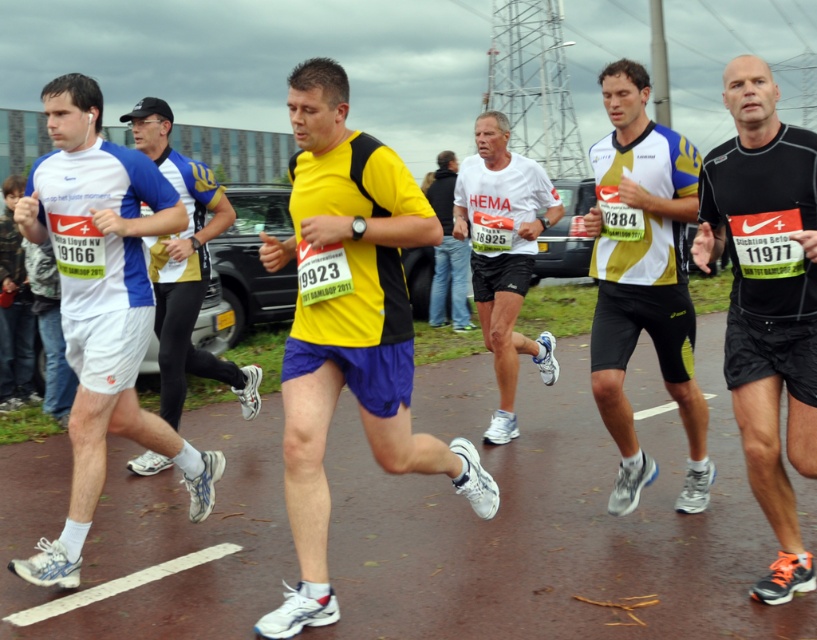
Can you confirm if black matte running shoe at center is smaller than white matte shirt at center?

Yes.

In order to click on black matte running shoe at center in this screenshot , I will do `click(766, 300)`.

Between black matte running shoe at center and yellow and white jersey at center, which one appears on the left side from the viewer's perspective?

Positioned to the left is yellow and white jersey at center.

Is black matte running shoe at center thinner than yellow and white jersey at center?

Yes, black matte running shoe at center is thinner than yellow and white jersey at center.

Who is more forward, [795,292] or [650,148]?

Point [795,292] is in front.

At what (x,y) coordinates should I click in order to perform the action: click on black matte running shoe at center. Please return your answer as a coordinate pair (x, y). Looking at the image, I should click on (766, 300).

What do you see at coordinates (643, 280) in the screenshot? Image resolution: width=817 pixels, height=640 pixels. I see `yellow and white jersey at center` at bounding box center [643, 280].

Between point (682, 372) and point (168, 296), which one is positioned behind?

The point (168, 296) is behind.

Locate an element on the screen. The image size is (817, 640). yellow and white jersey at center is located at coordinates (643, 280).